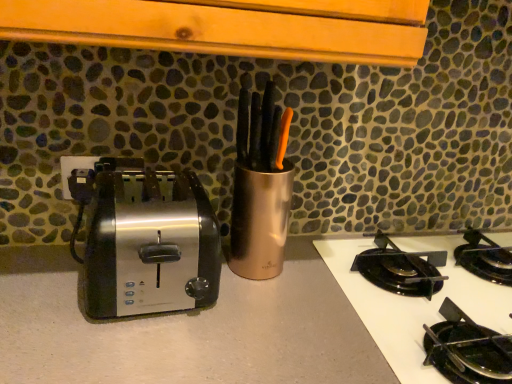
Question: From the image's perspective, is black glass cooktop at lower right beneath satin metallic toaster at left?

Choices:
 (A) no
 (B) yes

Answer: (B)

Question: Is black glass cooktop at lower right surrounding satin metallic toaster at left?

Choices:
 (A) yes
 (B) no

Answer: (B)

Question: From the image's perspective, is black glass cooktop at lower right above satin metallic toaster at left?

Choices:
 (A) yes
 (B) no

Answer: (B)

Question: Is black glass cooktop at lower right bigger than satin metallic toaster at left?

Choices:
 (A) no
 (B) yes

Answer: (B)

Question: From a real-world perspective, is black glass cooktop at lower right below satin metallic toaster at left?

Choices:
 (A) yes
 (B) no

Answer: (A)

Question: Considering their positions, is black glass cooktop at lower right located in front of or behind satin finish countertop at center?

Choices:
 (A) front
 (B) behind

Answer: (B)

Question: In the image, is black glass cooktop at lower right on the left side or the right side of satin finish countertop at center?

Choices:
 (A) left
 (B) right

Answer: (B)

Question: From the image's perspective, is black glass cooktop at lower right positioned above or below satin finish countertop at center?

Choices:
 (A) above
 (B) below

Answer: (A)

Question: Is black glass cooktop at lower right situated inside satin finish countertop at center or outside?

Choices:
 (A) outside
 (B) inside

Answer: (B)

Question: Is satin finish countertop at center taller or shorter than black glass cooktop at lower right?

Choices:
 (A) tall
 (B) short

Answer: (A)

Question: Relative to black glass cooktop at lower right, is satin finish countertop at center in front or behind?

Choices:
 (A) behind
 (B) front

Answer: (B)

Question: From the image's perspective, relative to black glass cooktop at lower right, is satin finish countertop at center above or below?

Choices:
 (A) below
 (B) above

Answer: (A)

Question: Is satin finish countertop at center inside or outside of black glass cooktop at lower right?

Choices:
 (A) inside
 (B) outside

Answer: (B)

Question: From a real-world perspective, is satin metallic toaster at left positioned above or below black glass cooktop at lower right?

Choices:
 (A) below
 (B) above

Answer: (B)

Question: Is satin metallic toaster at left taller or shorter than black glass cooktop at lower right?

Choices:
 (A) tall
 (B) short

Answer: (A)